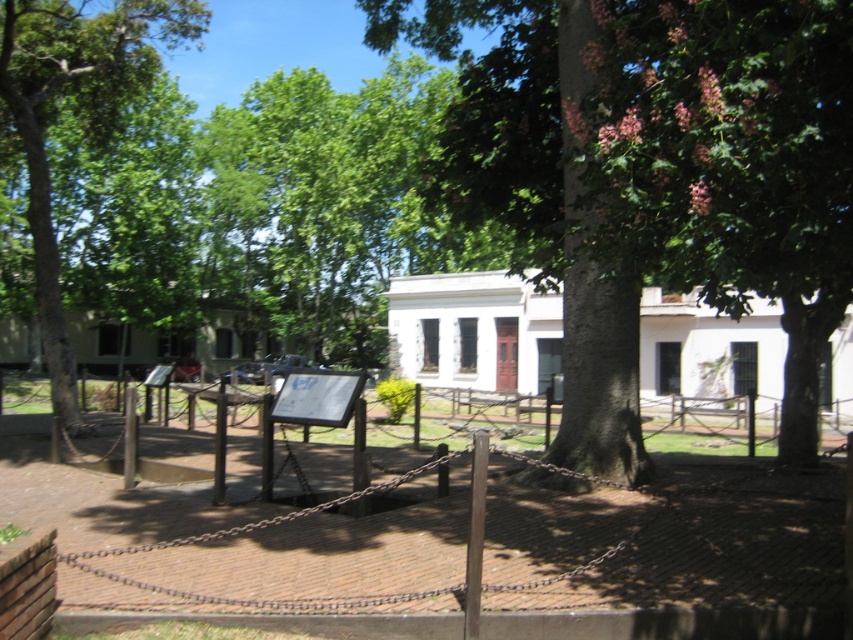
Question: Observing the image, what is the correct spatial positioning of green textured bark at center in reference to wooden fence at center?

Choices:
 (A) right
 (B) left

Answer: (B)

Question: Considering the real-world distances, which object is closest to the green textured bark at center?

Choices:
 (A) wooden fence at center
 (B) green leafy tree at left

Answer: (A)

Question: Which of the following is the farthest from the observer?

Choices:
 (A) (375, 579)
 (B) (68, 410)

Answer: (B)

Question: Is wooden fence at center positioned before green leafy tree at left?

Choices:
 (A) no
 (B) yes

Answer: (B)

Question: Estimate the real-world distances between objects in this image. Which object is closer to the wooden fence at center?

Choices:
 (A) green textured bark at center
 (B) green leafy tree at left

Answer: (A)

Question: Does green textured bark at center have a greater width compared to green leafy tree at left?

Choices:
 (A) yes
 (B) no

Answer: (B)